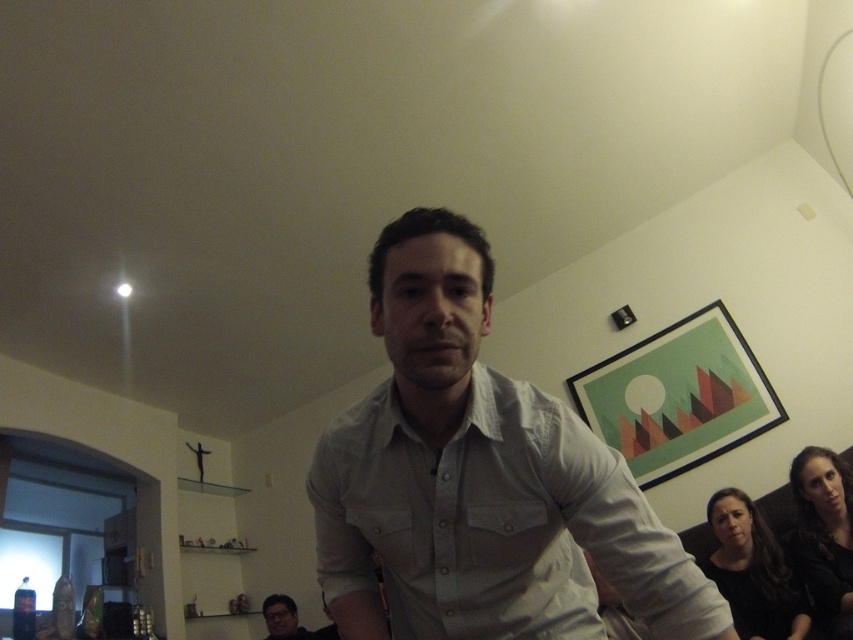
Question: Can you confirm if white cotton shirt at center is bigger than matte gray shirt at center?

Choices:
 (A) no
 (B) yes

Answer: (B)

Question: Which object appears closest to the camera in this image?

Choices:
 (A) matte gray shirt at center
 (B) white cotton shirt at center

Answer: (B)

Question: Which point appears closest to the camera in this image?

Choices:
 (A) (293, 611)
 (B) (368, 397)

Answer: (B)

Question: Does white cotton shirt at center lie behind matte gray shirt at center?

Choices:
 (A) yes
 (B) no

Answer: (B)

Question: Which point appears closest to the camera in this image?

Choices:
 (A) (413, 428)
 (B) (281, 602)

Answer: (A)

Question: Does white cotton shirt at center come in front of matte gray shirt at center?

Choices:
 (A) no
 (B) yes

Answer: (B)